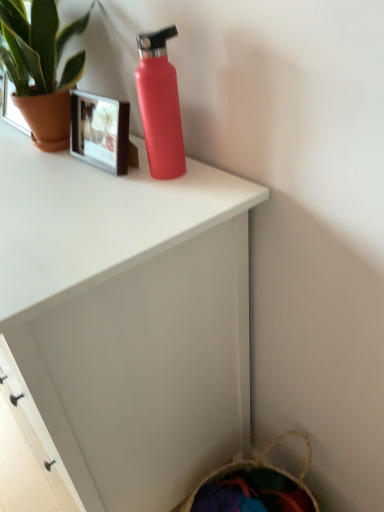
Question: Is green matte plant at upper left behind matte red water bottle at upper center?

Choices:
 (A) no
 (B) yes

Answer: (B)

Question: Is matte red water bottle at upper center inside green matte plant at upper left?

Choices:
 (A) no
 (B) yes

Answer: (A)

Question: Is green matte plant at upper left oriented away from matte red water bottle at upper center?

Choices:
 (A) yes
 (B) no

Answer: (B)

Question: Does green matte plant at upper left come in front of matte red water bottle at upper center?

Choices:
 (A) yes
 (B) no

Answer: (B)

Question: Does green matte plant at upper left have a larger size compared to matte red water bottle at upper center?

Choices:
 (A) yes
 (B) no

Answer: (B)

Question: From a real-world perspective, is matte red water bottle at upper center above or below matte pink bottle at upper center?

Choices:
 (A) below
 (B) above

Answer: (A)

Question: From the image's perspective, relative to matte pink bottle at upper center, is matte red water bottle at upper center above or below?

Choices:
 (A) below
 (B) above

Answer: (A)

Question: Is point (84, 370) positioned closer to the camera than point (155, 130)?

Choices:
 (A) closer
 (B) farther

Answer: (A)

Question: Do you think matte red water bottle at upper center is within matte pink bottle at upper center, or outside of it?

Choices:
 (A) inside
 (B) outside

Answer: (B)

Question: Is matte pink bottle at upper center situated inside matte red water bottle at upper center or outside?

Choices:
 (A) inside
 (B) outside

Answer: (B)

Question: From a real-world perspective, is matte pink bottle at upper center above or below matte red water bottle at upper center?

Choices:
 (A) below
 (B) above

Answer: (B)

Question: From the image's perspective, is matte pink bottle at upper center above or below matte red water bottle at upper center?

Choices:
 (A) above
 (B) below

Answer: (A)

Question: Considering the positions of matte pink bottle at upper center and matte red water bottle at upper center in the image, is matte pink bottle at upper center bigger or smaller than matte red water bottle at upper center?

Choices:
 (A) big
 (B) small

Answer: (B)

Question: Considering the relative positions of green matte plant at upper left and matte red water bottle at upper center in the image provided, is green matte plant at upper left to the left or to the right of matte red water bottle at upper center?

Choices:
 (A) left
 (B) right

Answer: (B)

Question: From a real-world perspective, is green matte plant at upper left positioned above or below matte red water bottle at upper center?

Choices:
 (A) below
 (B) above

Answer: (B)